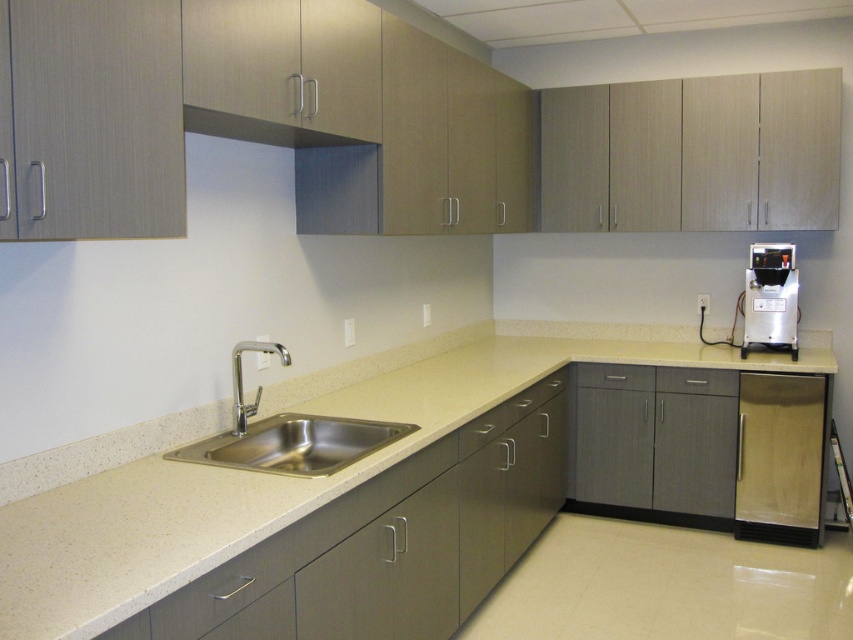
Does beige laminate countertop at center have a smaller size compared to satin silver appliance at right?

No, beige laminate countertop at center is not smaller than satin silver appliance at right.

Between beige laminate countertop at center and satin silver appliance at right, which one is positioned lower?

beige laminate countertop at center is lower down.

Between point (544, 358) and point (752, 244), which one is positioned in front?

Point (544, 358) is more forward.

Image resolution: width=853 pixels, height=640 pixels. What are the coordinates of `beige laminate countertop at center` in the screenshot? It's located at (276, 480).

Is point (786, 413) closer to camera compared to point (666, 374)?

Yes, it is in front of point (666, 374).

Who is more distant from viewer, (822, 388) or (724, 380)?

The point (724, 380) is more distant.

The width and height of the screenshot is (853, 640). Identify the location of wooden refrigerator at lower right. (779, 458).

Consider the image. Between satin silver appliance at right and gray matte drawer at center, which one appears on the right side from the viewer's perspective?

Positioned to the right is satin silver appliance at right.

Can you confirm if satin silver appliance at right is positioned to the left of gray matte drawer at center?

Incorrect, satin silver appliance at right is not on the left side of gray matte drawer at center.

Which is in front, point (764, 282) or point (630, 365)?

Point (764, 282)

Locate an element on the screen. The width and height of the screenshot is (853, 640). satin silver appliance at right is located at coordinates (770, 298).